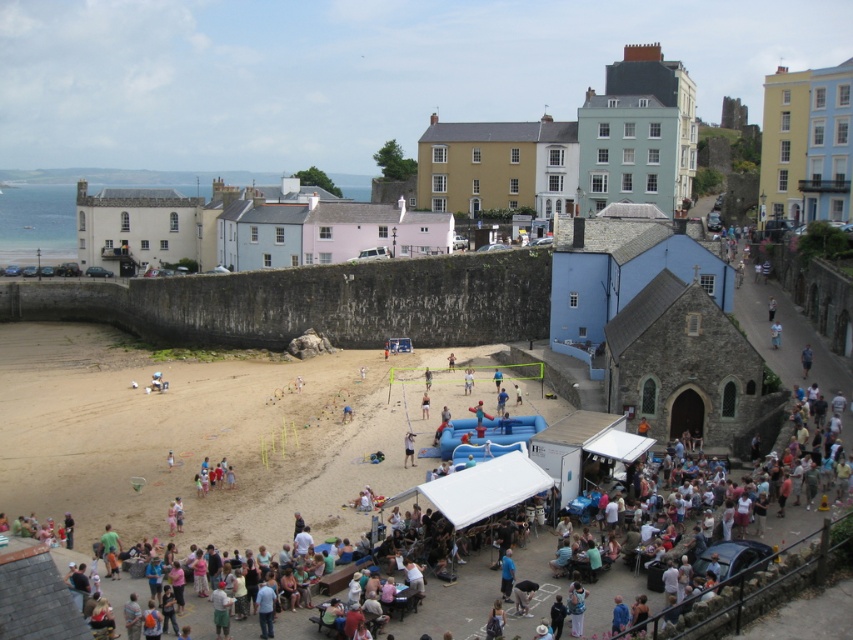
Question: Observing the image, what is the correct spatial positioning of light brown sand at center in reference to light brown wooden paddle at center?

Choices:
 (A) above
 (B) below

Answer: (A)

Question: Which point is closer to the camera?

Choices:
 (A) light brown wooden paddle at center
 (B) light brown sand at center

Answer: (B)

Question: Among these points, which one is farthest from the camera?

Choices:
 (A) (408, 444)
 (B) (386, 448)

Answer: (B)

Question: Does light brown sand at center have a larger size compared to light brown wooden paddle at center?

Choices:
 (A) yes
 (B) no

Answer: (A)

Question: Is light brown sand at center bigger than light brown wooden paddle at center?

Choices:
 (A) yes
 (B) no

Answer: (A)

Question: Which of the following is the farthest from the observer?

Choices:
 (A) (351, 403)
 (B) (405, 445)

Answer: (A)